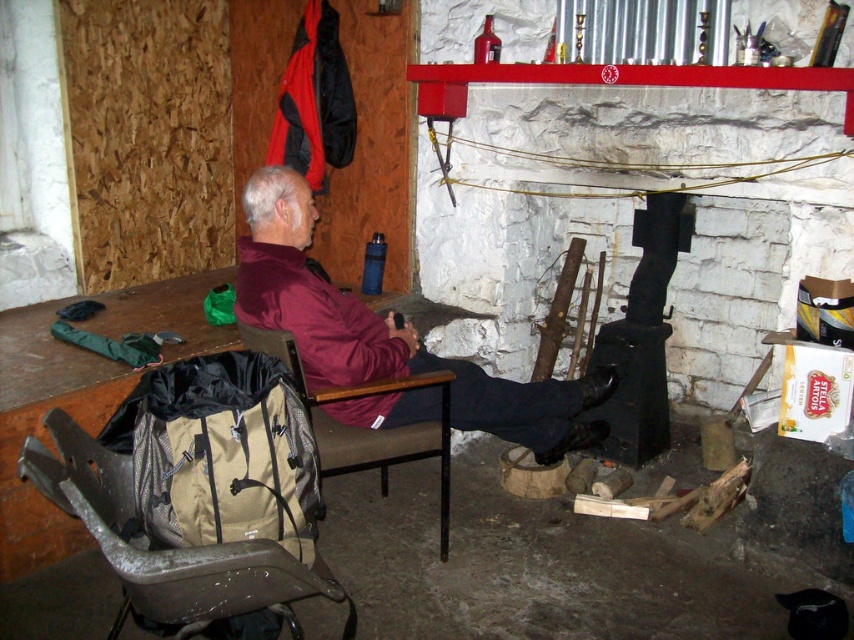
From the picture: You are standing in the cabin and want to hand the maroon fabric jacket at center to someone across the room. If you can throw the jacket 2 meters, will you be able to reach them?

The maroon fabric jacket at center is 2.29 meters away from the camera, so if you can throw it 2 meters, you won not be able to reach them as the distance is slightly longer than your throwing range.

You are a guest at this cabin and want to sit as close as possible to the fireplace. Which object, the maroon fabric jacket at center or the brown fabric chair at left, is closer to the fireplace?

The maroon fabric jacket at center is closer to the fireplace because the brown fabric chair at left is behind it.